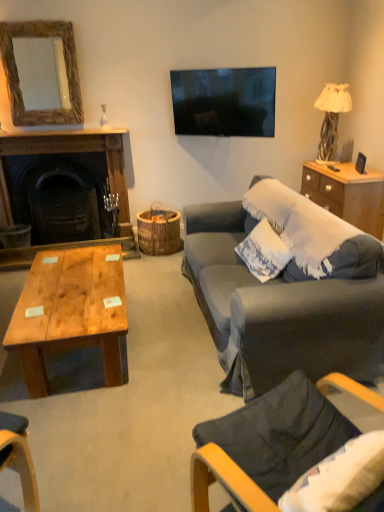
You are a GUI agent. You are given a task and a screenshot of the screen. Output one action in this format:
    pyautogui.click(x=<x>, y=<y>)
    Task: Click on the vacant area in front of black plastic remote control at right
    This screenshot has height=512, width=384.
    Given the screenshot: What is the action you would take?
    pyautogui.click(x=337, y=175)